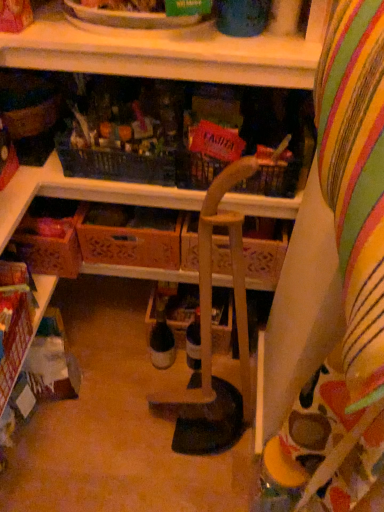
Question: Is wooden chair at center aimed at wooden at upper center, the 2th shelf when ordered from bottom to top?

Choices:
 (A) no
 (B) yes

Answer: (A)

Question: From a real-world perspective, is wooden chair at center on wooden at upper center, which is counted as the second shelf, starting from the left?

Choices:
 (A) yes
 (B) no

Answer: (B)

Question: Is wooden chair at center smaller than wooden at upper center, which is counted as the second shelf, starting from the left?

Choices:
 (A) yes
 (B) no

Answer: (A)

Question: Is wooden chair at center taller than wooden at upper center, which is counted as the second shelf, starting from the left?

Choices:
 (A) yes
 (B) no

Answer: (A)

Question: Does wooden chair at center have a lesser height compared to wooden at upper center, which is counted as the second shelf, starting from the left?

Choices:
 (A) yes
 (B) no

Answer: (B)

Question: Looking at the image, does wooden crate at center, positioned as the first drawer in right-to-left order, seem bigger or smaller compared to wooden crate at lower left, acting as the first drawer starting from the left?

Choices:
 (A) big
 (B) small

Answer: (A)

Question: From the image's perspective, is wooden crate at center, marked as the 2th drawer in a left-to-right arrangement, located above or below wooden crate at lower left, the 2th drawer when ordered from right to left?

Choices:
 (A) above
 (B) below

Answer: (A)

Question: Is wooden crate at center, marked as the 2th drawer in a left-to-right arrangement, inside or outside of wooden crate at lower left, the 2th drawer when ordered from right to left?

Choices:
 (A) inside
 (B) outside

Answer: (B)

Question: Based on their positions, is wooden crate at center, positioned as the first drawer in right-to-left order, located to the left or right of wooden crate at lower left, the 2th drawer when ordered from right to left?

Choices:
 (A) left
 (B) right

Answer: (B)

Question: In the image, is wooden crate at lower left, acting as the first drawer starting from the left, on the left side or the right side of wooden crate at lower left, marked as the second shelf in a top-to-bottom arrangement?

Choices:
 (A) right
 (B) left

Answer: (A)

Question: Considering the positions of point (26, 240) and point (23, 353), is point (26, 240) closer or farther from the camera than point (23, 353)?

Choices:
 (A) closer
 (B) farther

Answer: (B)

Question: Is wooden crate at lower left, the 2th drawer when ordered from right to left, situated inside wooden crate at lower left, the 1th shelf ordered from the bottom, or outside?

Choices:
 (A) inside
 (B) outside

Answer: (B)

Question: From a real-world perspective, is wooden crate at lower left, acting as the first drawer starting from the left, above or below wooden crate at lower left, which ranks as the first shelf in left-to-right order?

Choices:
 (A) above
 (B) below

Answer: (A)

Question: Considering the positions of wooden crate at lower left, the 2th drawer when ordered from right to left, and translucent glass bottle at center in the image, is wooden crate at lower left, the 2th drawer when ordered from right to left, wider or thinner than translucent glass bottle at center?

Choices:
 (A) thin
 (B) wide

Answer: (B)

Question: Does point (29, 266) appear closer or farther from the camera than point (155, 324)?

Choices:
 (A) closer
 (B) farther

Answer: (A)